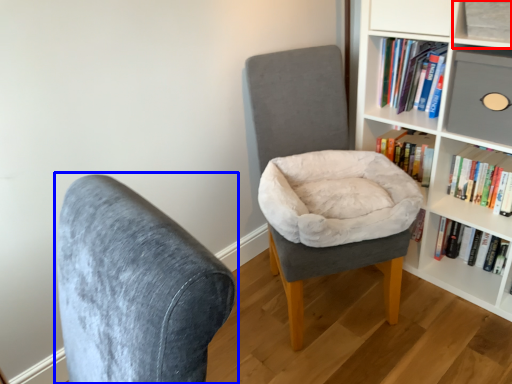
Question: Which point is further to the camera, shelf (highlighted by a red box) or chair (highlighted by a blue box)?

Choices:
 (A) shelf
 (B) chair

Answer: (A)